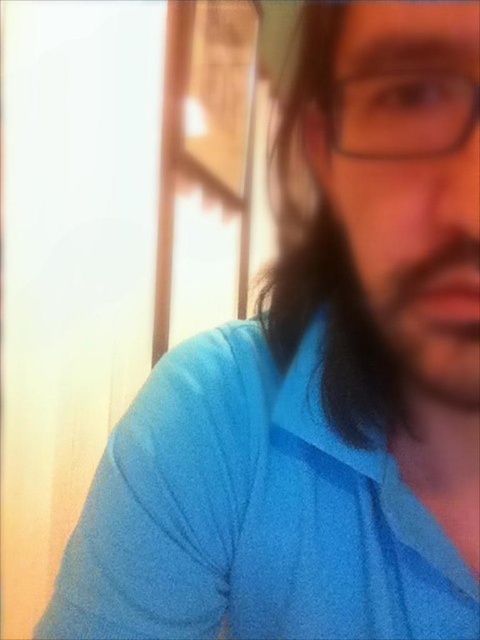
Question: Which point appears farthest from the camera in this image?

Choices:
 (A) (360, 148)
 (B) (369, 349)

Answer: (B)

Question: Which object is farther from the camera taking this photo?

Choices:
 (A) dark brown silky hair at center
 (B) transparent plastic glasses at center

Answer: (A)

Question: Is dark brown silky hair at center positioned behind transparent plastic glasses at center?

Choices:
 (A) no
 (B) yes

Answer: (B)

Question: Does dark brown silky hair at center lie behind transparent plastic glasses at center?

Choices:
 (A) no
 (B) yes

Answer: (B)

Question: Can you confirm if dark brown silky hair at center is positioned to the left of transparent plastic glasses at center?

Choices:
 (A) no
 (B) yes

Answer: (B)